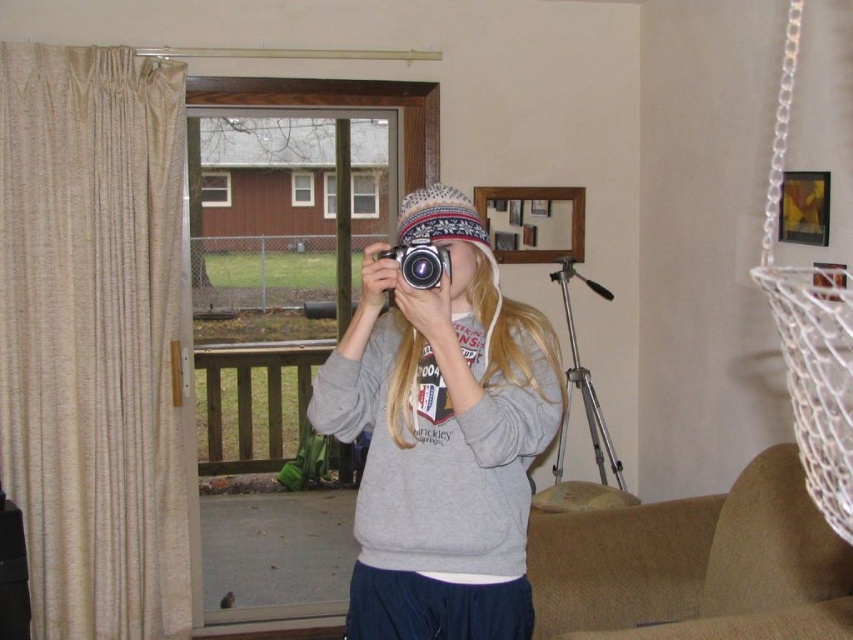
You are a photographer trying to set up a tripod for a long exposure shot. The camera you are holding requires a tripod that is at least 3 meters away to avoid vibrations. Can the silver metallic tripod at right be used for this purpose?

The silver metallic tripod at right is 3.18 meters away from the camera, which meets the minimum requirement of 3 meters. Therefore, it can be used for the long exposure shot without causing vibrations.

From the picture: You are the photographer in the scene. You notice two points marked in the image. One is at coordinates point (519, 346) and the other at point (599, 461). Which point is closer to your camera lens?

Point (519, 346) is closer to the camera than point (599, 461).

You are setting up equipment for a photo shoot. You have a silver metallic tripod at right and a silver metallic camera at center. Which object should you adjust if you need to make one of them smaller to fit through a narrow doorway?

The silver metallic tripod at right is larger in size than the silver metallic camera at center, so you should adjust the tripod to make it smaller to fit through the narrow doorway.